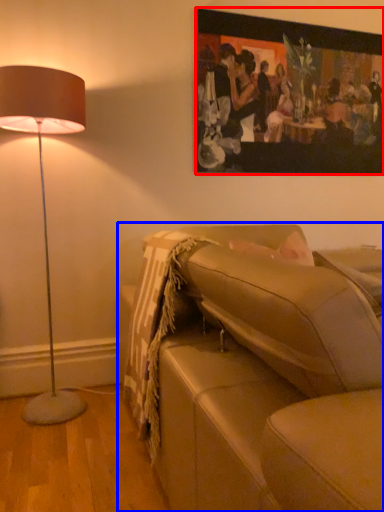
Question: Which object appears farthest to the camera in this image, picture frame (highlighted by a red box) or studio couch (highlighted by a blue box)?

Choices:
 (A) picture frame
 (B) studio couch

Answer: (A)